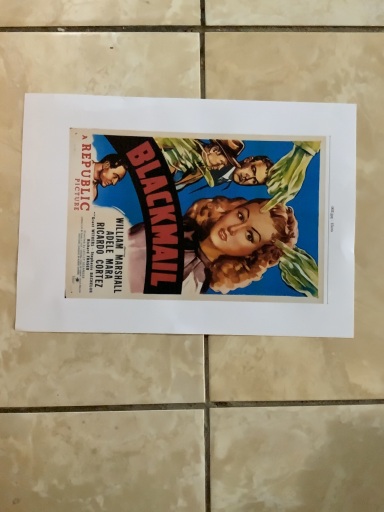
What are the coordinates of `vacant space situated above matte paper poster at center (from a real-world perspective)` in the screenshot? It's located at (190, 214).